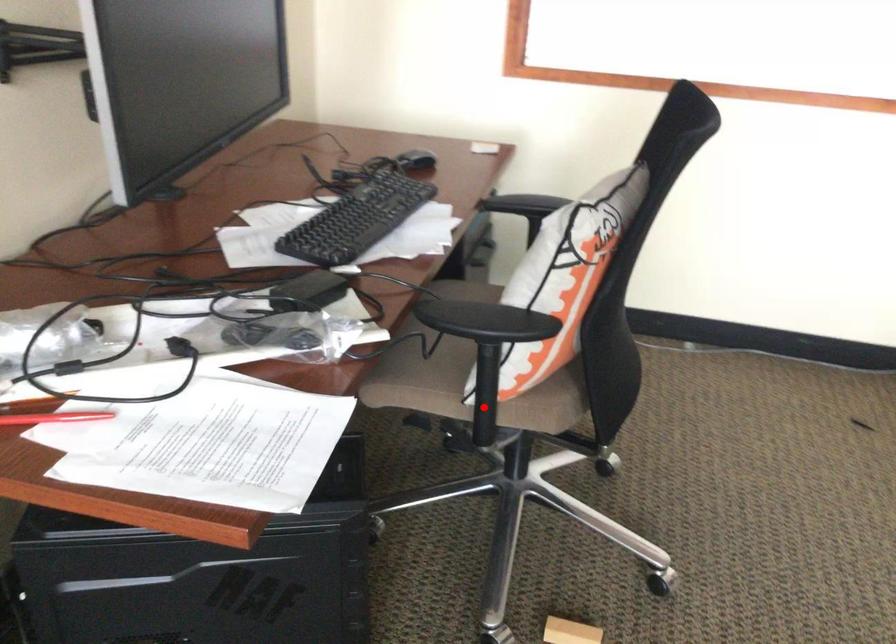
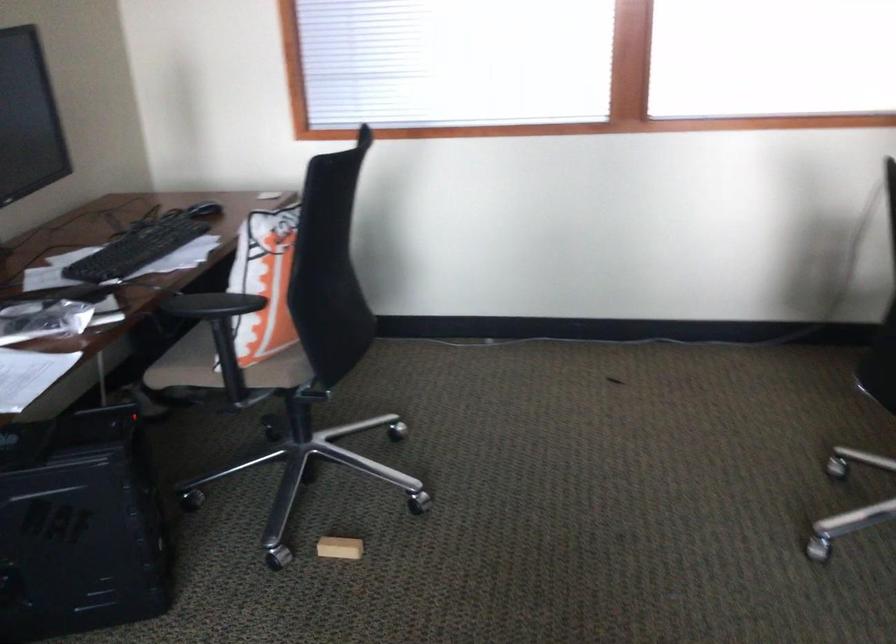
Question: I am providing you with two images of the same scene from different viewpoints. A red point is marked on the first image. Can you still see the location of the red point in image 2?

Choices:
 (A) Yes
 (B) No

Answer: (A)